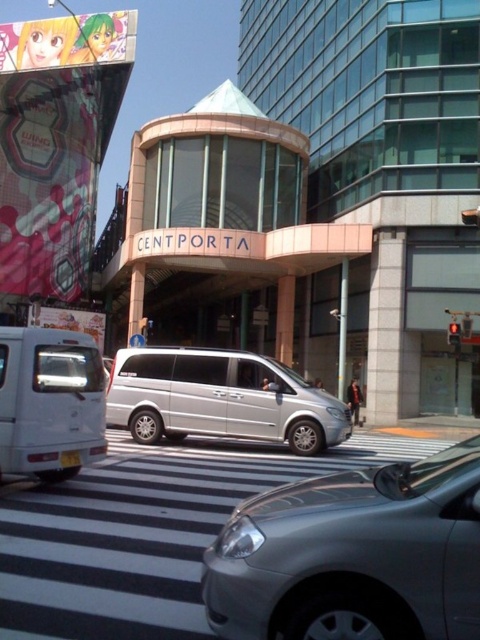
Based on the photo, how far apart are the silver metallic van at center and the gray car on the left?

The silver metallic van at center and the gray car on the left are 28.98 feet apart.